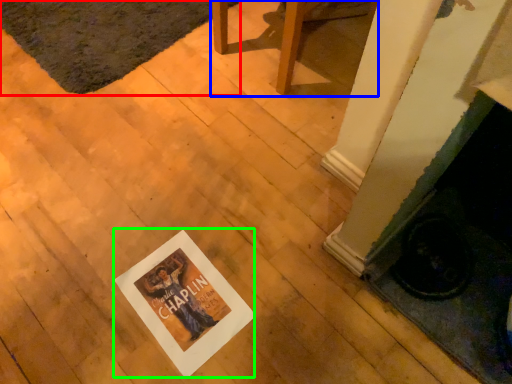
Question: Which is nearer to the mat (highlighted by a red box)? furniture (highlighted by a blue box) or postcard (highlighted by a green box).

Choices:
 (A) furniture
 (B) postcard

Answer: (A)